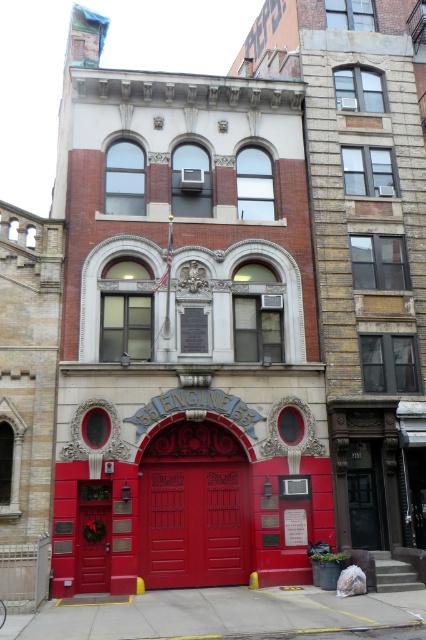
You are standing directly in front of the fire station entrance. Where are the smooth glossy red doors at center located relative to your position?

The smooth glossy red doors at center are located at the entrance of the fire station, directly in front of you.

You are a firefighter arriving at Engine 55 fire station. You need to enter the building but are confused about which door to use. Based on the scene, which door should you approach first, the smooth glossy red doors at center or the matte red door at center?

The matte red door at center is behind the smooth glossy red doors at center, so you should approach the smooth glossy red doors at center first as they are in front and likely the main entrance.